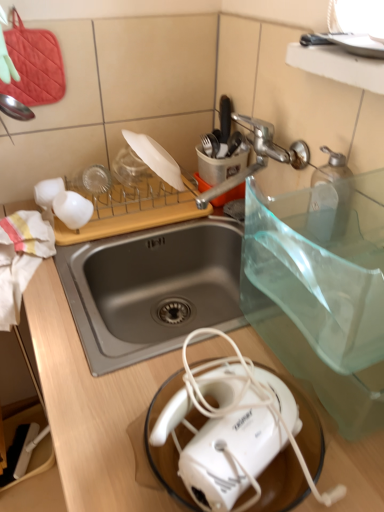
This screenshot has height=512, width=384. In order to click on free space to the left of white plastic toaster at lower center in this screenshot , I will do `click(102, 428)`.